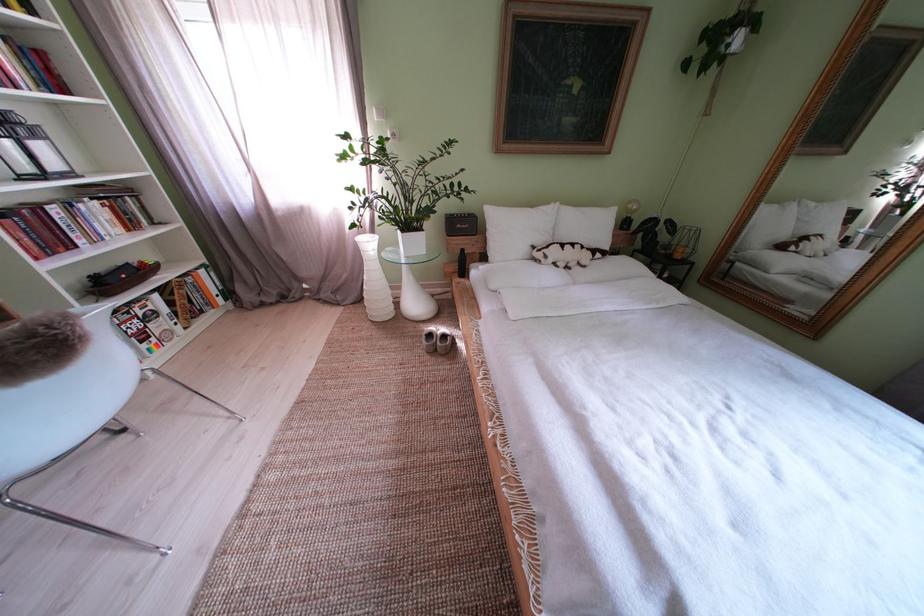
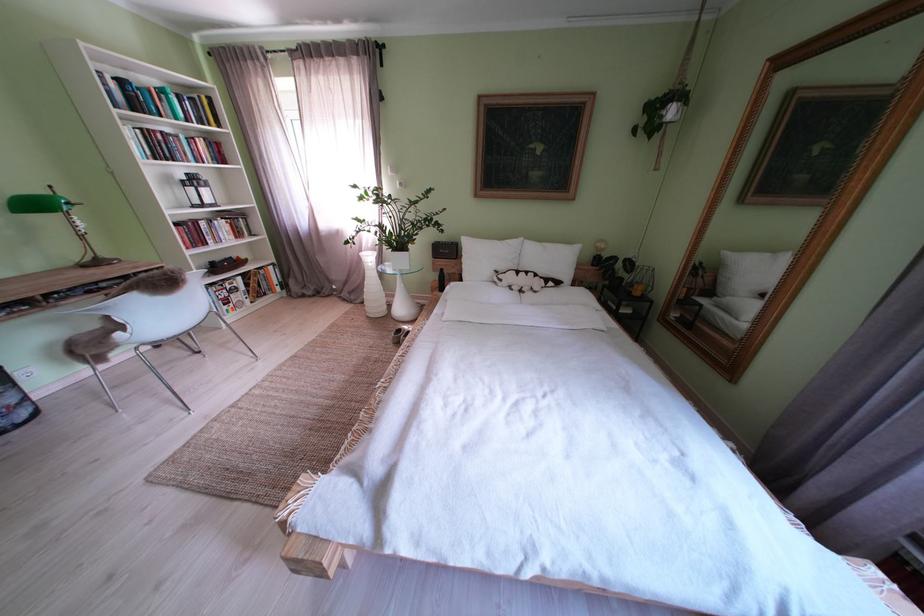
Where in the second image is the point corresponding to [689,262] from the first image?

(648, 299)